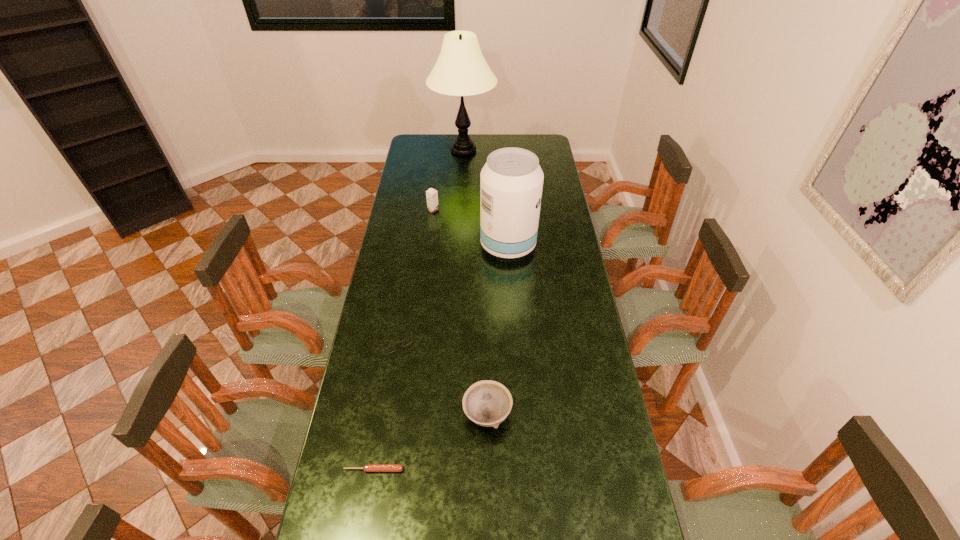
Where is `chocolate milk that is at the left edge`? chocolate milk that is at the left edge is located at coordinates (432, 195).

Find the location of a particular element. spectacles that is at the left edge is located at coordinates (408, 340).

Where is `sausage that is at the left edge`? This screenshot has width=960, height=540. sausage that is at the left edge is located at coordinates (367, 467).

The width and height of the screenshot is (960, 540). Identify the location of object that is at the far left corner. (461, 70).

Locate an element on the screen. free space at the far edge is located at coordinates (438, 154).

Where is `vacant space at the left edge of the desktop`? Image resolution: width=960 pixels, height=540 pixels. vacant space at the left edge of the desktop is located at coordinates (411, 327).

The height and width of the screenshot is (540, 960). Identify the location of free space at the right edge of the desktop. (581, 299).

Where is `free region at the far right corner of the desktop`? The height and width of the screenshot is (540, 960). free region at the far right corner of the desktop is located at coordinates (525, 137).

Image resolution: width=960 pixels, height=540 pixels. I want to click on vacant area between the farthest object and the fifth nearest object, so click(448, 180).

The width and height of the screenshot is (960, 540). In order to click on vacant area that lies between the tallest object and the nearest object in this screenshot , I will do `click(419, 310)`.